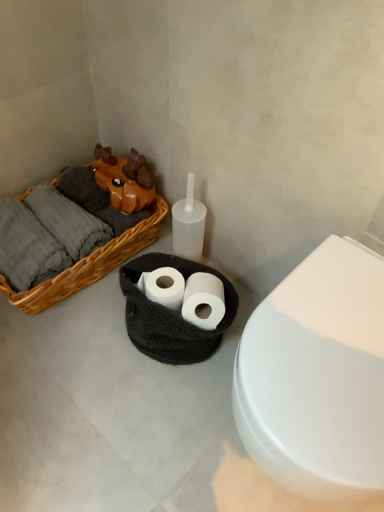
Question: Which is correct: white paper at center, placed as the second toilet paper when sorted from left to right, is inside black crocheted basket at center, or outside of it?

Choices:
 (A) outside
 (B) inside

Answer: (B)

Question: Is point (198, 320) positioned closer to the camera than point (130, 295)?

Choices:
 (A) closer
 (B) farther

Answer: (A)

Question: Estimate the real-world distances between objects in this image. Which object is farther from the white glossy toilet at center right?

Choices:
 (A) white paper at center, which is the first toilet paper in right-to-left order
 (B) black crocheted basket at center
 (C) white matte toilet paper at center, which appears as the first toilet paper when viewed from the left
 (D) woven wood basket at left

Answer: (D)

Question: Which object is positioned farthest from the black crocheted basket at center?

Choices:
 (A) white paper at center, which is the first toilet paper in right-to-left order
 (B) white glossy toilet at center right
 (C) woven wood basket at left
 (D) white matte toilet paper at center, placed as the second toilet paper when sorted from right to left

Answer: (B)